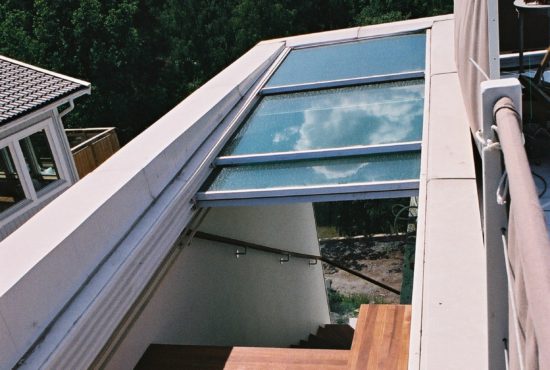
This screenshot has height=370, width=550. Find the location of `curtain`. curtain is located at coordinates tap(472, 71).